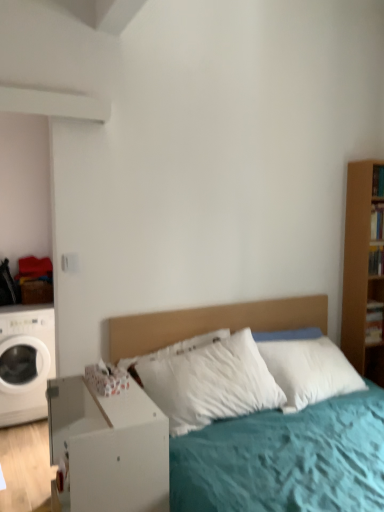
Question: Is white matte washing machine at left taller or shorter than white soft bed at center?

Choices:
 (A) short
 (B) tall

Answer: (B)

Question: Looking at the image, does white matte washing machine at left seem bigger or smaller compared to white soft bed at center?

Choices:
 (A) small
 (B) big

Answer: (A)

Question: Which is farther from the white soft bed at center?

Choices:
 (A) white matte washing machine at left
 (B) white matte nightstand at lower left

Answer: (A)

Question: Which object is the farthest from the white matte nightstand at lower left?

Choices:
 (A) white soft bed at center
 (B) white matte washing machine at left

Answer: (B)